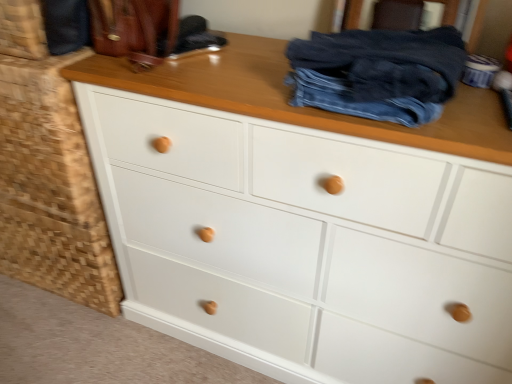
Question: Can we say denim at center lies outside white wood drawer at lower left?

Choices:
 (A) no
 (B) yes

Answer: (B)

Question: Is denim at center positioned in front of white wood drawer at lower left?

Choices:
 (A) no
 (B) yes

Answer: (B)

Question: From the image's perspective, is denim at center under white wood drawer at lower left?

Choices:
 (A) yes
 (B) no

Answer: (B)

Question: Is denim at center further to the viewer compared to white wood drawer at lower left?

Choices:
 (A) yes
 (B) no

Answer: (B)

Question: Is white wood drawer at lower left located within denim at center?

Choices:
 (A) yes
 (B) no

Answer: (B)

Question: Can you confirm if denim at center is smaller than white wood drawer at lower left?

Choices:
 (A) no
 (B) yes

Answer: (B)

Question: Is white wood drawer at lower left smaller than denim at center?

Choices:
 (A) no
 (B) yes

Answer: (A)

Question: From the image's perspective, would you say white wood drawer at lower left is shown under denim at center?

Choices:
 (A) no
 (B) yes

Answer: (B)

Question: Is the depth of white wood drawer at lower left greater than that of denim at center?

Choices:
 (A) no
 (B) yes

Answer: (B)

Question: Is white wood drawer at lower left oriented away from denim at center?

Choices:
 (A) no
 (B) yes

Answer: (A)

Question: From the image's perspective, is white wood drawer at lower left over denim at center?

Choices:
 (A) no
 (B) yes

Answer: (A)

Question: Considering the relative positions of white wood drawer at lower left and denim at center in the image provided, is white wood drawer at lower left in front of denim at center?

Choices:
 (A) no
 (B) yes

Answer: (A)

Question: Do you think denim at center is within white wood drawer at lower left, or outside of it?

Choices:
 (A) outside
 (B) inside

Answer: (A)